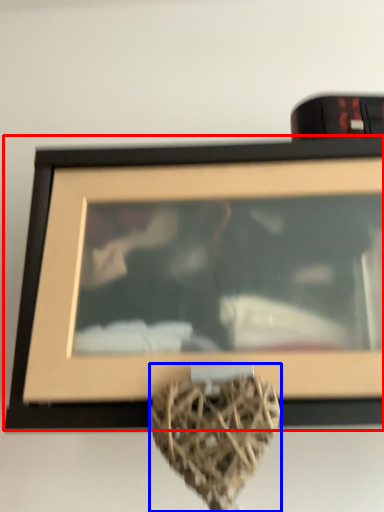
Question: Which object is further to the camera taking this photo, picture frame (highlighted by a red box) or vase (highlighted by a blue box)?

Choices:
 (A) picture frame
 (B) vase

Answer: (A)